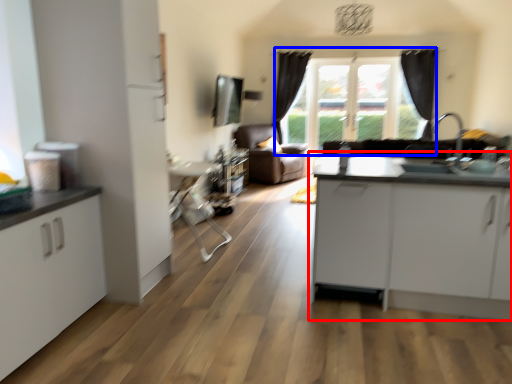
Question: Which object appears farthest to the camera in this image, table (highlighted by a red box) or window (highlighted by a blue box)?

Choices:
 (A) table
 (B) window

Answer: (B)